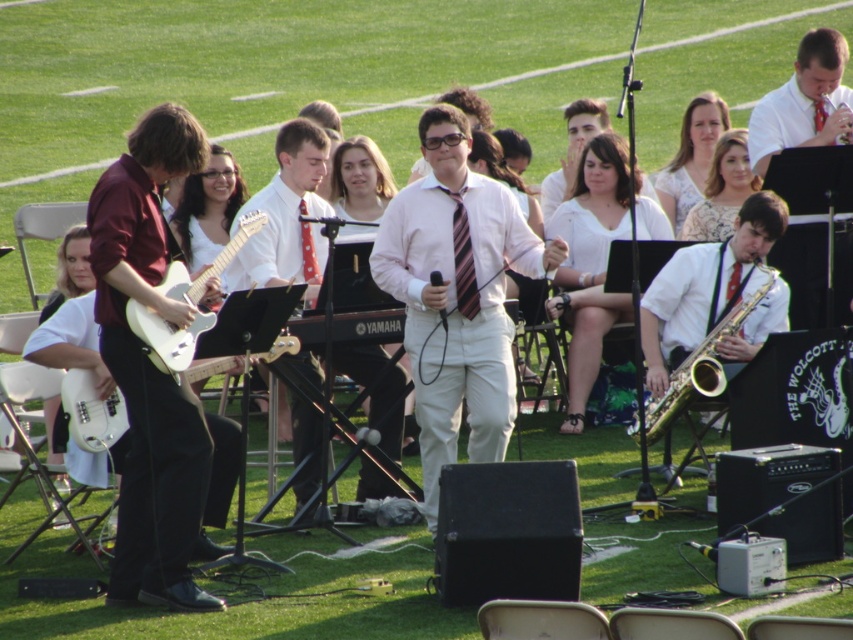
You are a photographer at the event and want to capture a photo that includes both the pink satin shirt at center and the white matte electric guitar at left. Based on their positions, which object should you focus on first if you want to frame them both in the shot?

The pink satin shirt at center is to the right of the white matte electric guitar at left. To frame both in the shot, focus on the white matte electric guitar at left first, then adjust to include the pink satin shirt at center to the right of it.

You are a photographer at the event and want to capture a photo that includes both the white matte electric guitar at left and the gold brass saxophone at right. Based on their positions, which instrument will appear closer to the camera in the photo?

The white matte electric guitar at left will appear closer to the camera in the photo because it is positioned over the gold brass saxophone at right, indicating it is in front spatially.

You are a stagehand setting up equipment for the band. You have two guitars to place on the left side of the stage. The white matte electric guitar at left and the white glossy electric guitar at left. Which guitar should you choose if you need to fit it into a narrow guitar stand that can only accommodate guitars up to the width of the thinner one?

You should choose the white glossy electric guitar at left because the white matte electric guitar at left might be wider, making the glossy one more likely to fit in the narrow guitar stand.